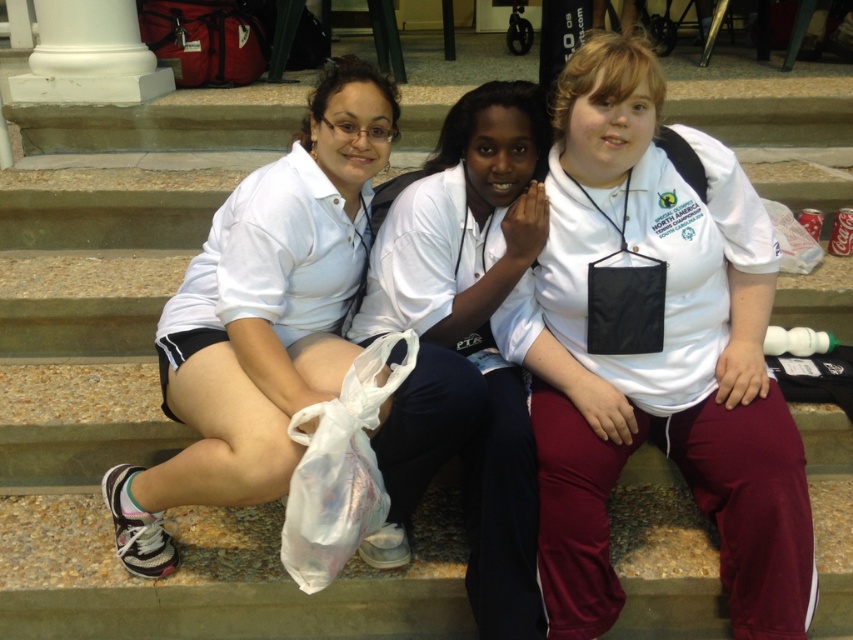
Can you confirm if white matte shorts at lower left is positioned to the right of white cotton shirt at center?

Incorrect, white matte shorts at lower left is not on the right side of white cotton shirt at center.

Which is more to the right, white matte shorts at lower left or white cotton shirt at center?

Positioned to the right is white cotton shirt at center.

What do you see at coordinates (260, 317) in the screenshot? I see `white matte shorts at lower left` at bounding box center [260, 317].

Identify the location of white matte shorts at lower left. This screenshot has width=853, height=640. (260, 317).

Does white matte shirt at center come behind white matte shorts at left?

That is False.

Who is positioned more to the left, white matte shirt at center or white matte shorts at left?

white matte shorts at left is more to the left.

Who is more distant from viewer, (x=654, y=204) or (x=346, y=285)?

Point (x=346, y=285)

Identify the location of white matte shirt at center. The height and width of the screenshot is (640, 853). (663, 394).

Can you confirm if white matte shirt at center is positioned to the right of white cotton shirt at center?

Correct, you'll find white matte shirt at center to the right of white cotton shirt at center.

Which is in front, point (747, 205) or point (450, 412)?

Point (450, 412) is more forward.

This screenshot has height=640, width=853. I want to click on white matte shirt at center, so click(663, 394).